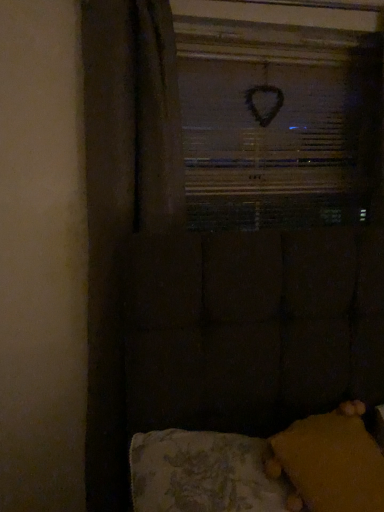
Question: Should I look upward or downward to see black matte heart at upper center?

Choices:
 (A) down
 (B) up

Answer: (B)

Question: Is velvet yellow cushion at lower right surrounding black matte heart at upper center?

Choices:
 (A) yes
 (B) no

Answer: (B)

Question: Is velvet yellow cushion at lower right positioned far away from black matte heart at upper center?

Choices:
 (A) no
 (B) yes

Answer: (B)

Question: From the image's perspective, would you say velvet yellow cushion at lower right is shown under black matte heart at upper center?

Choices:
 (A) no
 (B) yes

Answer: (B)

Question: Does velvet yellow cushion at lower right appear on the left side of black matte heart at upper center?

Choices:
 (A) yes
 (B) no

Answer: (A)

Question: From a real-world perspective, is velvet yellow cushion at lower right located beneath black matte heart at upper center?

Choices:
 (A) no
 (B) yes

Answer: (B)

Question: Is velvet yellow cushion at lower right aimed at black matte heart at upper center?

Choices:
 (A) no
 (B) yes

Answer: (A)

Question: Is black matte heart at upper center at the left side of yellow fuzzy pillow at lower right?

Choices:
 (A) yes
 (B) no

Answer: (A)

Question: Considering the relative sizes of black matte heart at upper center and yellow fuzzy pillow at lower right in the image provided, is black matte heart at upper center taller than yellow fuzzy pillow at lower right?

Choices:
 (A) no
 (B) yes

Answer: (B)

Question: Is the position of black matte heart at upper center less distant than that of yellow fuzzy pillow at lower right?

Choices:
 (A) no
 (B) yes

Answer: (A)

Question: Is black matte heart at upper center facing towards yellow fuzzy pillow at lower right?

Choices:
 (A) yes
 (B) no

Answer: (B)

Question: Can you confirm if black matte heart at upper center is wider than yellow fuzzy pillow at lower right?

Choices:
 (A) yes
 (B) no

Answer: (B)

Question: Can you see black matte heart at upper center touching yellow fuzzy pillow at lower right?

Choices:
 (A) no
 (B) yes

Answer: (A)

Question: Is yellow fuzzy pillow at lower right far away from velvet yellow cushion at lower right?

Choices:
 (A) yes
 (B) no

Answer: (B)